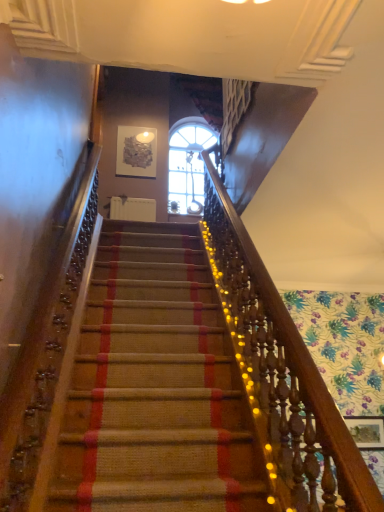
Describe the element at coordinates (136, 152) in the screenshot. I see `metallic mosaic art at upper center` at that location.

At what (x,y) coordinates should I click in order to perform the action: click on metallic mosaic art at upper center. Please return your answer as a coordinate pair (x, y). This screenshot has width=384, height=512. Looking at the image, I should click on (136, 152).

This screenshot has height=512, width=384. In order to click on metallic mosaic art at upper center in this screenshot , I will do click(136, 152).